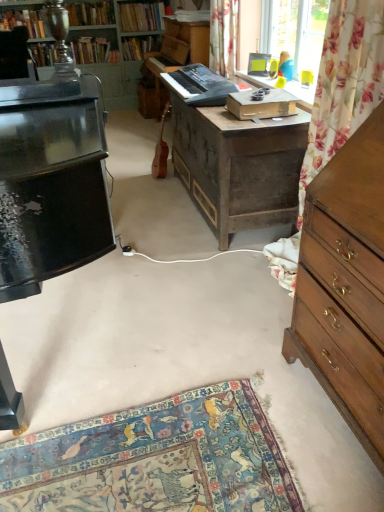
Question: From a real-world perspective, is brown wood guitar at center positioned above or below floral fabric curtain at upper center?

Choices:
 (A) below
 (B) above

Answer: (A)

Question: Is point (168, 101) closer or farther from the camera than point (221, 33)?

Choices:
 (A) closer
 (B) farther

Answer: (B)

Question: Considering the real-world distances, which object is farthest from the black glossy piano at left, acting as the third piano starting from the back?

Choices:
 (A) hardcover book at upper left, the second book in the left-to-right sequence
 (B) hardcover book at upper center, the 2th book when ordered from right to left
 (C) wooden chest of drawers at right
 (D) hardcover book at upper left, which is the third book in left-to-right order
 (E) brown wood guitar at center

Answer: (A)

Question: Which object is positioned closest to the brown wood guitar at center?

Choices:
 (A) floral fabric at upper right
 (B) hardcover book at upper left, the first book viewed from the left
 (C) hardcover book at upper center, which is the 5th book in left-to-right order
 (D) hardcover book at upper center, the 2th book when ordered from right to left
 (E) hardcover book at upper left, the second book in the left-to-right sequence

Answer: (D)